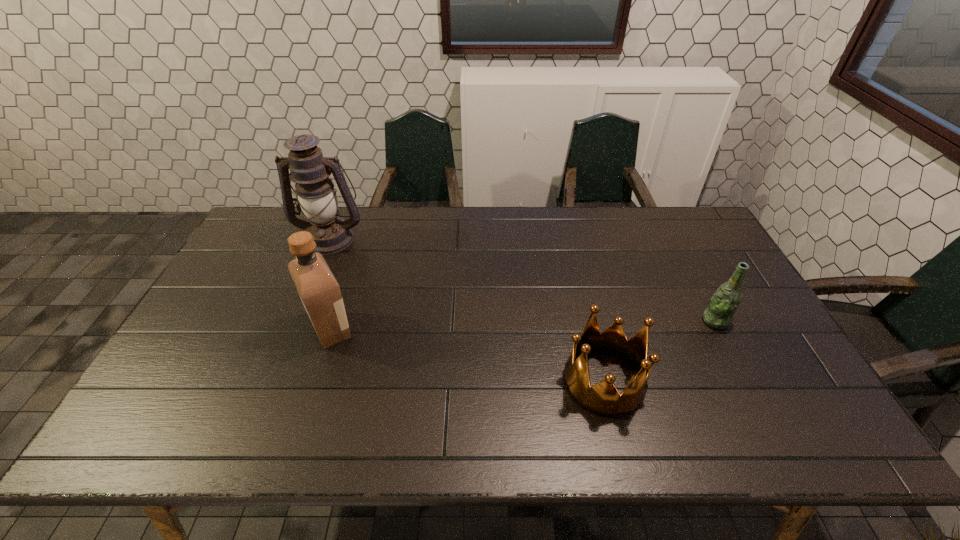
At what (x,y) coordinates should I click in order to perform the action: click on vacant region that satisfies the following two spatial constraints: 1. on the front-facing side of the crown; 2. on the right side of the liquor. Please return your answer as a coordinate pair (x, y). Looking at the image, I should click on (314, 381).

You are a GUI agent. You are given a task and a screenshot of the screen. Output one action in this format:
    pyautogui.click(x=<x>, y=<y>)
    Task: Click on the free space that satisfies the following two spatial constraints: 1. on the front side of the third object from left to right; 2. on the right side of the farthest object
    The width and height of the screenshot is (960, 540).
    Given the screenshot: What is the action you would take?
    coord(273,381)